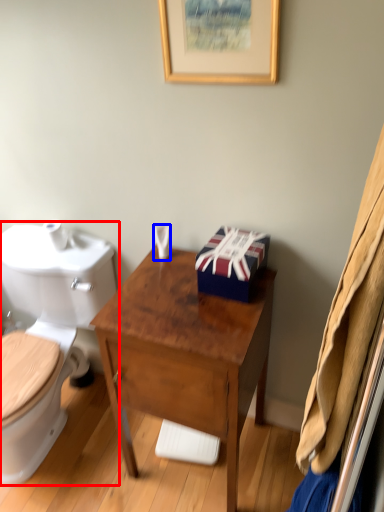
Question: Which object is further to the camera taking this photo, toilet (highlighted by a red box) or toiletries (highlighted by a blue box)?

Choices:
 (A) toilet
 (B) toiletries

Answer: (B)